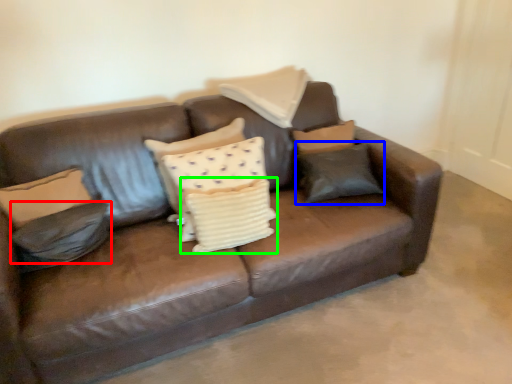
Question: Considering the real-world distances, which object is closest to pillow (highlighted by a red box)? pillow (highlighted by a blue box) or pillow (highlighted by a green box).

Choices:
 (A) pillow
 (B) pillow

Answer: (B)